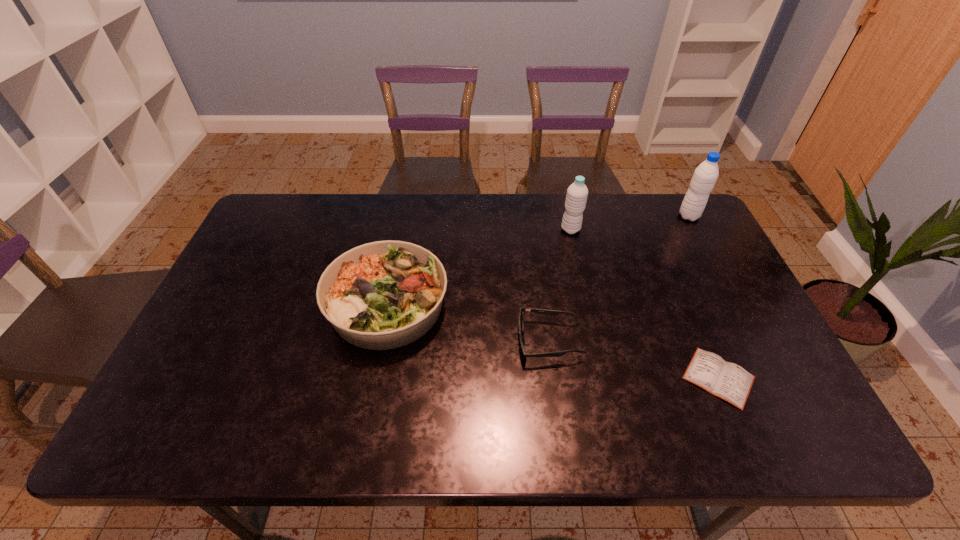
Locate an element on the screen. the farthest object is located at coordinates (705, 176).

At what (x,y) coordinates should I click in order to perform the action: click on the rightmost object. Please return your answer as a coordinate pair (x, y). This screenshot has width=960, height=540. Looking at the image, I should click on (705, 176).

Locate an element on the screen. the fourth shortest object is located at coordinates (577, 193).

You are a GUI agent. You are given a task and a screenshot of the screen. Output one action in this format:
    pyautogui.click(x=<x>, y=<y>)
    Task: Click on the second farthest object
    This screenshot has width=960, height=540.
    Given the screenshot: What is the action you would take?
    pyautogui.click(x=577, y=193)

Locate an element on the screen. This screenshot has height=540, width=960. the third shortest object is located at coordinates (382, 295).

Where is `salad plate`? This screenshot has width=960, height=540. salad plate is located at coordinates (382, 295).

Identify the location of the second shortest object. (542, 311).

You are a GUI agent. You are given a task and a screenshot of the screen. Output one action in this format:
    pyautogui.click(x=<x>, y=<y>)
    Task: Click on the sunglasses
    
    Given the screenshot: What is the action you would take?
    pyautogui.click(x=542, y=311)

Identify the location of the fourth object from left to right. (728, 381).

This screenshot has width=960, height=540. I want to click on the shortest object, so click(x=728, y=381).